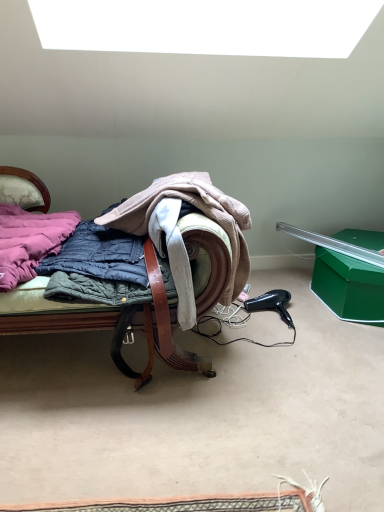
This screenshot has width=384, height=512. What do you see at coordinates (271, 304) in the screenshot?
I see `black plastic hair dryer at lower right` at bounding box center [271, 304].

This screenshot has height=512, width=384. What do you see at coordinates (121, 326) in the screenshot?
I see `quilted fabric chair at center` at bounding box center [121, 326].

The image size is (384, 512). Describe the element at coordinates (179, 231) in the screenshot. I see `quilted fabric coat at center` at that location.

What do you see at coordinates (29, 241) in the screenshot? I see `pink quilted jacket at left` at bounding box center [29, 241].

You are a GUI agent. You are given a task and a screenshot of the screen. Output one action in this format:
    pyautogui.click(x=<x>, y=<y>)
    Task: Click on the black plastic hair dryer at lower right
    The height and width of the screenshot is (512, 384).
    Given the screenshot: What is the action you would take?
    pyautogui.click(x=271, y=304)

Which is behind, quilted fabric coat at center or black plastic hair dryer at lower right?

black plastic hair dryer at lower right is behind.

Is quilted fabric coat at center inside or outside of black plastic hair dryer at lower right?

quilted fabric coat at center exists outside the volume of black plastic hair dryer at lower right.

From a real-world perspective, is quilted fabric coat at center physically below black plastic hair dryer at lower right?

Actually, quilted fabric coat at center is physically above black plastic hair dryer at lower right in the real world.

From the image's perspective, is pink quilted jacket at left above quilted fabric coat at center?

Indeed, from the image's perspective, pink quilted jacket at left is shown above quilted fabric coat at center.

Where is `underclothes above the quilted fabric coat at center (from a real-world perspective)`? The width and height of the screenshot is (384, 512). underclothes above the quilted fabric coat at center (from a real-world perspective) is located at coordinates (29, 241).

Is pink quilted jacket at left in front of quilted fabric coat at center?

Yes, pink quilted jacket at left is closer to the viewer.

Between point (270, 301) and point (160, 226), which one is positioned behind?

The point (270, 301) is more distant.

Between black plastic hair dryer at lower right and quilted fabric coat at center, which one has more height?

Standing taller between the two is quilted fabric coat at center.

Is black plastic hair dryer at lower right positioned beyond the bounds of quilted fabric coat at center?

Indeed, black plastic hair dryer at lower right is completely outside quilted fabric coat at center.

Considering the relative sizes of black plastic hair dryer at lower right and quilted fabric coat at center in the image provided, is black plastic hair dryer at lower right thinner than quilted fabric coat at center?

Yes.

Which of these two, quilted fabric coat at center or quilted fabric chair at center, is thinner?

quilted fabric coat at center.

In the image, is quilted fabric coat at center on the left side or the right side of quilted fabric chair at center?

In the image, quilted fabric coat at center appears on the right side of quilted fabric chair at center.

Is quilted fabric coat at center shorter than quilted fabric chair at center?

Correct, quilted fabric coat at center is not as tall as quilted fabric chair at center.

From the image's perspective, is quilted fabric coat at center located beneath quilted fabric chair at center?

Correct, quilted fabric coat at center appears lower than quilted fabric chair at center in the image.

The width and height of the screenshot is (384, 512). I want to click on cloak behind the pink quilted jacket at left, so click(x=179, y=231).

Would you say quilted fabric coat at center contains pink quilted jacket at left?

No, pink quilted jacket at left is located outside of quilted fabric coat at center.

From a real-world perspective, who is located higher, quilted fabric coat at center or pink quilted jacket at left?

pink quilted jacket at left.

Does quilted fabric coat at center come in front of pink quilted jacket at left?

No, the depth of quilted fabric coat at center is greater than that of pink quilted jacket at left.

Consider the image. Considering the sizes of pink quilted jacket at left and quilted fabric chair at center in the image, is pink quilted jacket at left taller or shorter than quilted fabric chair at center?

In the image, pink quilted jacket at left appears to be shorter than quilted fabric chair at center.

Is pink quilted jacket at left facing towards quilted fabric chair at center?

Yes, pink quilted jacket at left is turned towards quilted fabric chair at center.

Considering the points (50, 238) and (197, 210), which point is in front, point (50, 238) or point (197, 210)?

The point (197, 210) is more forward.

I want to click on furniture that is in front of the pink quilted jacket at left, so click(x=121, y=326).

Which is behind, point (26, 214) or point (272, 295)?

The point (272, 295) is more distant.

From the picture: Can you confirm if pink quilted jacket at left is positioned to the left of black plastic hair dryer at lower right?

Yes, pink quilted jacket at left is to the left of black plastic hair dryer at lower right.

Is pink quilted jacket at left aimed at black plastic hair dryer at lower right?

No, pink quilted jacket at left does not turn towards black plastic hair dryer at lower right.

The width and height of the screenshot is (384, 512). I want to click on hair drier lying below the quilted fabric coat at center (from the image's perspective), so click(x=271, y=304).

At what (x,y) coordinates should I click in order to perform the action: click on underclothes in front of the quilted fabric coat at center. Please return your answer as a coordinate pair (x, y). Looking at the image, I should click on (29, 241).

Which object lies nearer to the anchor point quilted fabric chair at center, black plastic hair dryer at lower right or quilted fabric coat at center?

Among the two, quilted fabric coat at center is located nearer to quilted fabric chair at center.

Looking at the image, which one is located closer to quilted fabric chair at center, pink quilted jacket at left or black plastic hair dryer at lower right?

pink quilted jacket at left lies closer to quilted fabric chair at center than the other object.

Estimate the real-world distances between objects in this image. Which object is closer to black plastic hair dryer at lower right, pink quilted jacket at left or quilted fabric chair at center?

The object closer to black plastic hair dryer at lower right is quilted fabric chair at center.

Considering their positions, is quilted fabric coat at center positioned closer to quilted fabric chair at center than black plastic hair dryer at lower right?

quilted fabric coat at center lies closer to quilted fabric chair at center than the other object.

From the image, which object appears to be farther from pink quilted jacket at left, quilted fabric coat at center or black plastic hair dryer at lower right?

Based on the image, black plastic hair dryer at lower right appears to be further to pink quilted jacket at left.

Looking at the image, which one is located further to black plastic hair dryer at lower right, quilted fabric coat at center or quilted fabric chair at center?

quilted fabric coat at center.

Which object lies further to the anchor point quilted fabric coat at center, pink quilted jacket at left or quilted fabric chair at center?

pink quilted jacket at left lies further to quilted fabric coat at center than the other object.

Estimate the real-world distances between objects in this image. Which object is closer to pink quilted jacket at left, quilted fabric chair at center or black plastic hair dryer at lower right?

quilted fabric chair at center lies closer to pink quilted jacket at left than the other object.

The width and height of the screenshot is (384, 512). In order to click on cloak situated between quilted fabric chair at center and black plastic hair dryer at lower right from left to right in this screenshot , I will do `click(179, 231)`.

I want to click on furniture between pink quilted jacket at left and black plastic hair dryer at lower right from left to right, so click(121, 326).

Locate an element on the screen. The height and width of the screenshot is (512, 384). cloak located between pink quilted jacket at left and black plastic hair dryer at lower right in the left-right direction is located at coordinates (179, 231).

Find the location of a particular element. Image resolution: width=384 pixels, height=512 pixels. furniture between pink quilted jacket at left and quilted fabric coat at center in the horizontal direction is located at coordinates (121, 326).